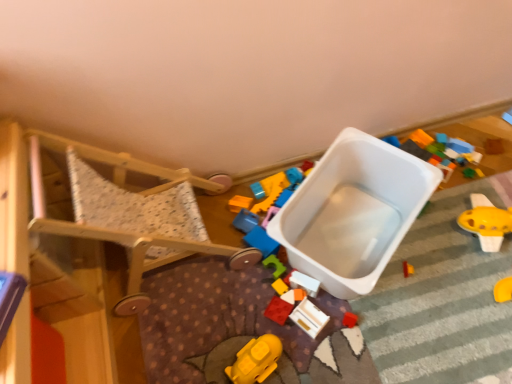
Find the location of `free space to the left of yellow matte toy at lower center, which is counted as the first toy, starting from the left`. free space to the left of yellow matte toy at lower center, which is counted as the first toy, starting from the left is located at coordinates tap(194, 349).